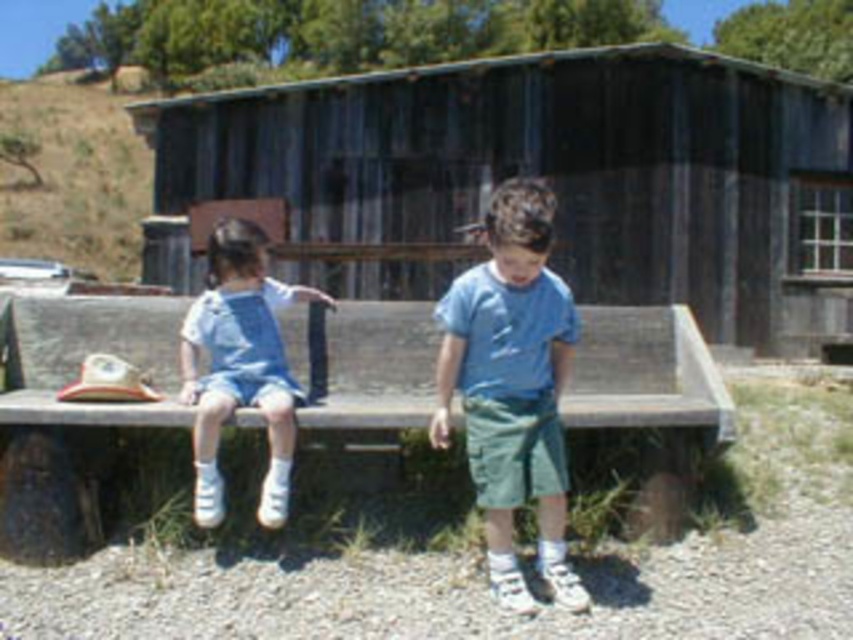
Consider the image. Can you confirm if weathered wood hut at center is thinner than wooden bench at center?

Incorrect, weathered wood hut at center's width is not less than wooden bench at center's.

Identify the location of weathered wood hut at center. This screenshot has width=853, height=640. (555, 168).

Locate an element on the screen. The image size is (853, 640). weathered wood hut at center is located at coordinates (555, 168).

At what (x,y) coordinates should I click in order to perform the action: click on weathered wood hut at center. Please return your answer as a coordinate pair (x, y). This screenshot has height=640, width=853. Looking at the image, I should click on pos(555,168).

Does wooden bench at center appear on the right side of blue cotton shirt at center?

Incorrect, wooden bench at center is not on the right side of blue cotton shirt at center.

Between wooden bench at center and blue cotton shirt at center, which one appears on the right side from the viewer's perspective?

Positioned to the right is blue cotton shirt at center.

Is point (82, 412) closer to viewer compared to point (468, 292)?

No.

Locate an element on the screen. The width and height of the screenshot is (853, 640). wooden bench at center is located at coordinates (73, 406).

Does weathered wood hut at center have a smaller size compared to blue cotton shirt at center?

No, weathered wood hut at center is not smaller than blue cotton shirt at center.

This screenshot has width=853, height=640. Identify the location of weathered wood hut at center. (555, 168).